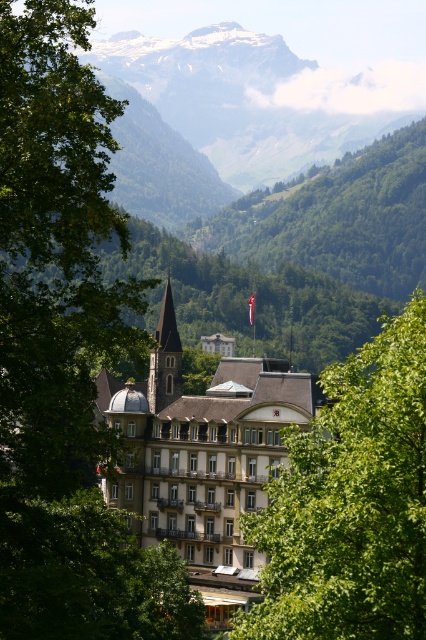
Looking at this image, is green leafy tree at center wider than brown stone hotel at center?

Yes, green leafy tree at center is wider than brown stone hotel at center.

At what (x,y) coordinates should I click in order to perform the action: click on green leafy tree at center. Please return your answer as a coordinate pair (x, y). This screenshot has width=426, height=640. Looking at the image, I should click on (351, 502).

Can you confirm if green leafy tree at left is wider than brown stone hotel at center?

Incorrect, green leafy tree at left's width does not surpass brown stone hotel at center's.

Who is more forward, (40, 68) or (282, 388)?

Positioned in front is point (40, 68).

Find the location of a particular element. Image resolution: width=426 pixels, height=640 pixels. green leafy tree at left is located at coordinates (66, 353).

This screenshot has width=426, height=640. What are the coordinates of `green leafy tree at left` in the screenshot? It's located at tap(66, 353).

Is point (256, 452) less distant than point (233, 186)?

Yes, point (256, 452) is closer to viewer.

In the scene shown: Is brown stone hotel at center closer to camera compared to green grassy mountain at upper center?

Yes, it is.

The height and width of the screenshot is (640, 426). Identify the location of brown stone hotel at center. (203, 456).